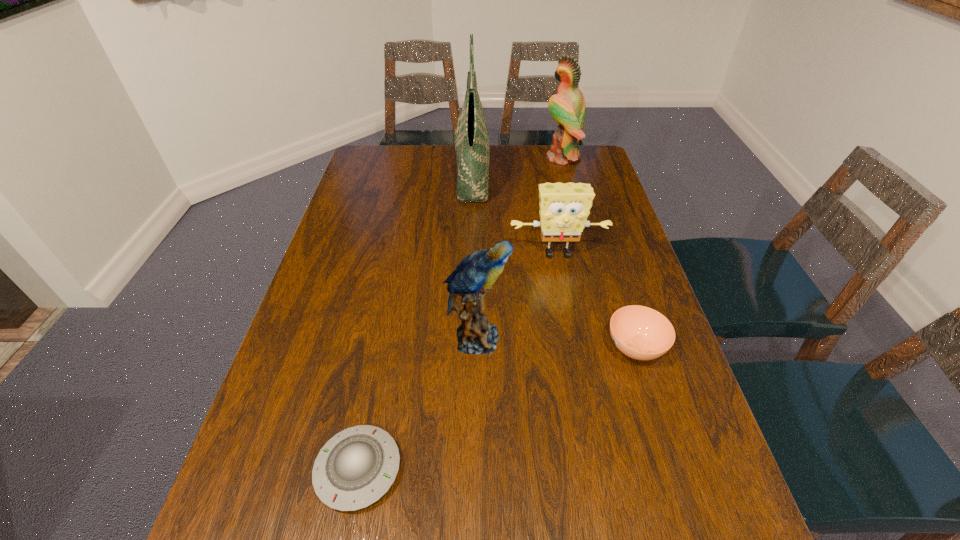
Find the location of a particular element. The width and height of the screenshot is (960, 540). the tallest object is located at coordinates (471, 138).

The image size is (960, 540). Identify the location of the taller parrot. (567, 107).

Find the location of `the fifth shortest object`. the fifth shortest object is located at coordinates (567, 107).

At what (x,y) coordinates should I click in order to perform the action: click on the left parrot. Please return your answer as a coordinate pair (x, y). Looking at the image, I should click on (474, 275).

You are a GUI agent. You are given a task and a screenshot of the screen. Output one action in this format:
    pyautogui.click(x=<x>, y=<y>)
    Task: Click on the shorter parrot
    This screenshot has width=960, height=540.
    Given the screenshot: What is the action you would take?
    pyautogui.click(x=474, y=275)

Identify the location of the third farthest object. (564, 208).

Find the location of a particular element. sponge is located at coordinates (564, 208).

Locate an element on the screen. the second shortest object is located at coordinates (641, 333).

Locate an element on the screen. Image resolution: width=960 pixels, height=540 pixels. the leftmost object is located at coordinates tap(355, 468).

Identify the location of saucer. (355, 468).